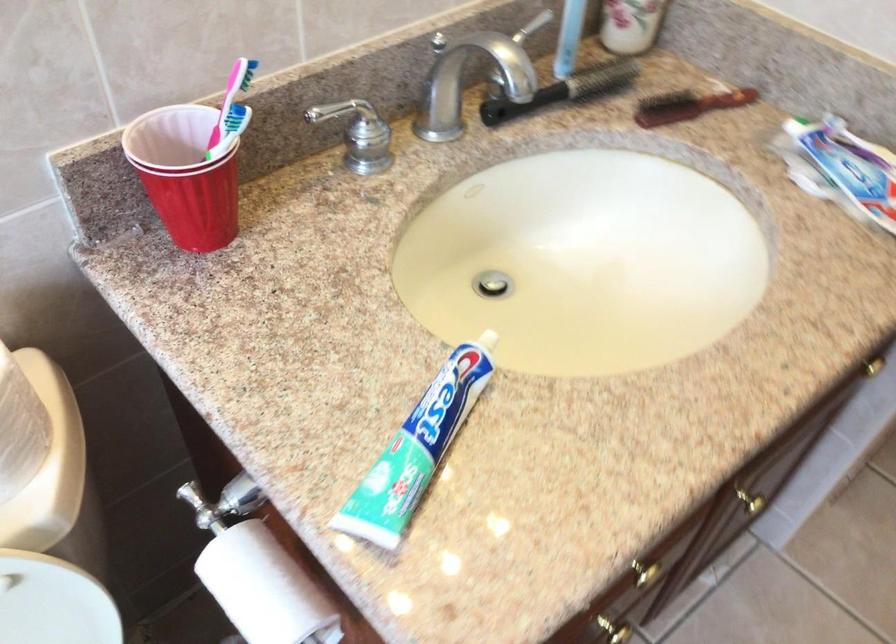
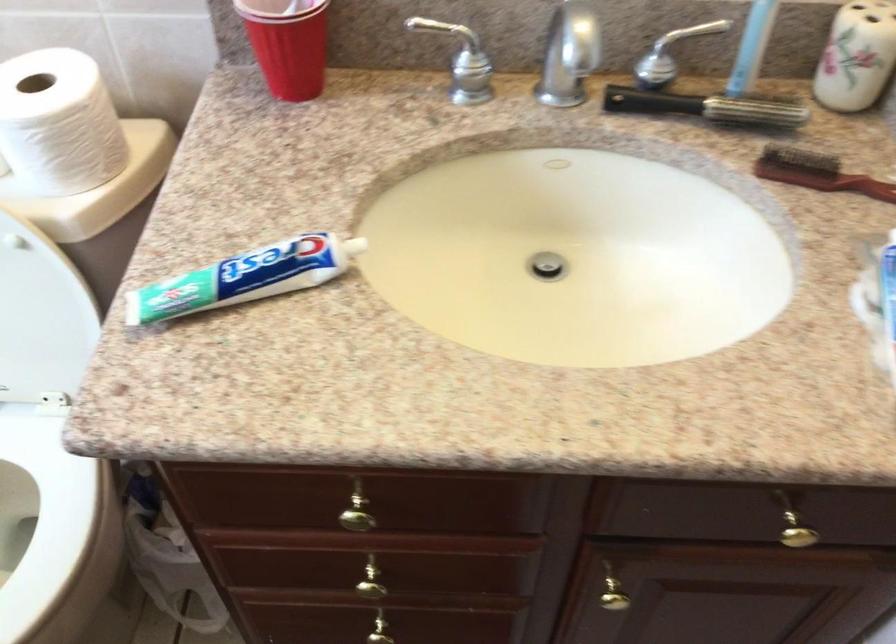
Find the pixel in the second image that matches the point at 212,187 in the first image.

(288, 44)